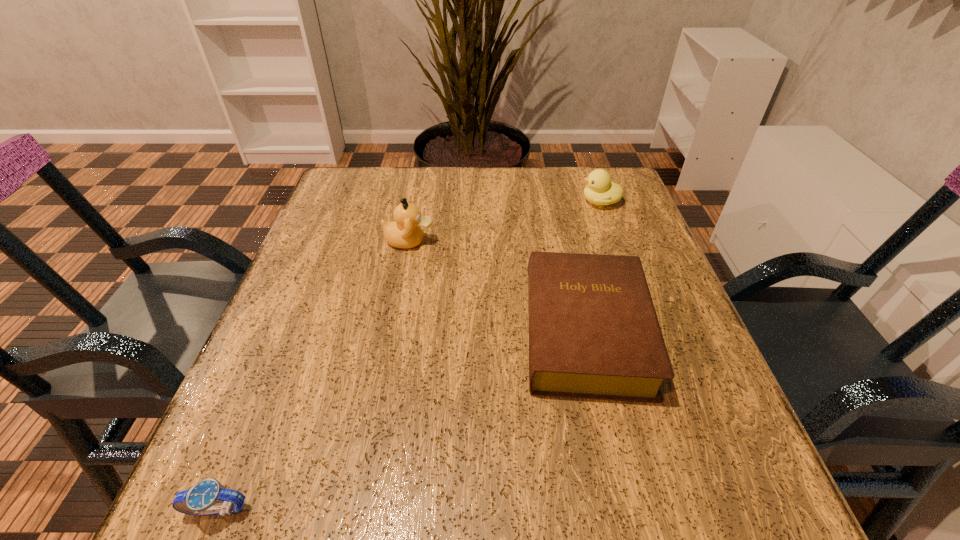
This screenshot has width=960, height=540. In order to click on vacant position located 0.170m at the beak of the farther duckling in this screenshot , I will do pos(513,202).

Find the location of a particular element. blank area located at the beak of the farther duckling is located at coordinates pos(504,202).

Locate an element on the screen. blank area located 0.110m on the left of the Bible is located at coordinates (461, 332).

Where is `free point located 0.380m on the back of the shortest object`? This screenshot has height=540, width=960. free point located 0.380m on the back of the shortest object is located at coordinates (305, 294).

Image resolution: width=960 pixels, height=540 pixels. Find the location of `object at the far edge`. object at the far edge is located at coordinates point(600,191).

Identify the location of object that is at the near edge. (202, 499).

This screenshot has height=540, width=960. Find the location of `object that is at the left edge`. object that is at the left edge is located at coordinates (202, 499).

Find the location of a particular element. The width and height of the screenshot is (960, 540). duckling located in the right edge section of the desktop is located at coordinates (600, 191).

You are a GUI agent. You are given a task and a screenshot of the screen. Output one action in this format:
    pyautogui.click(x=<x>, y=<y>)
    Task: Click on the Bible at the right edge
    
    Given the screenshot: What is the action you would take?
    pyautogui.click(x=593, y=330)

Where is `object situated at the near left corner`? object situated at the near left corner is located at coordinates (202, 499).